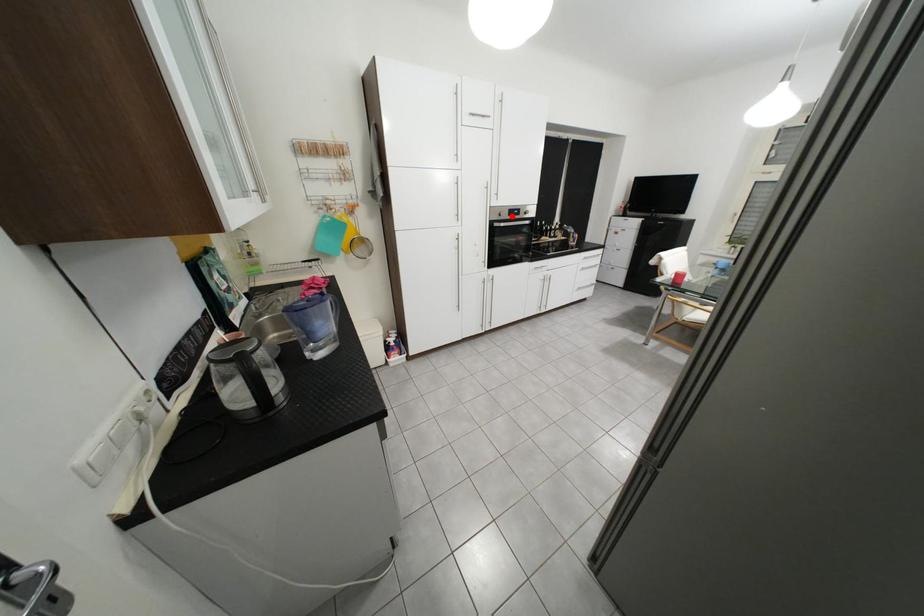
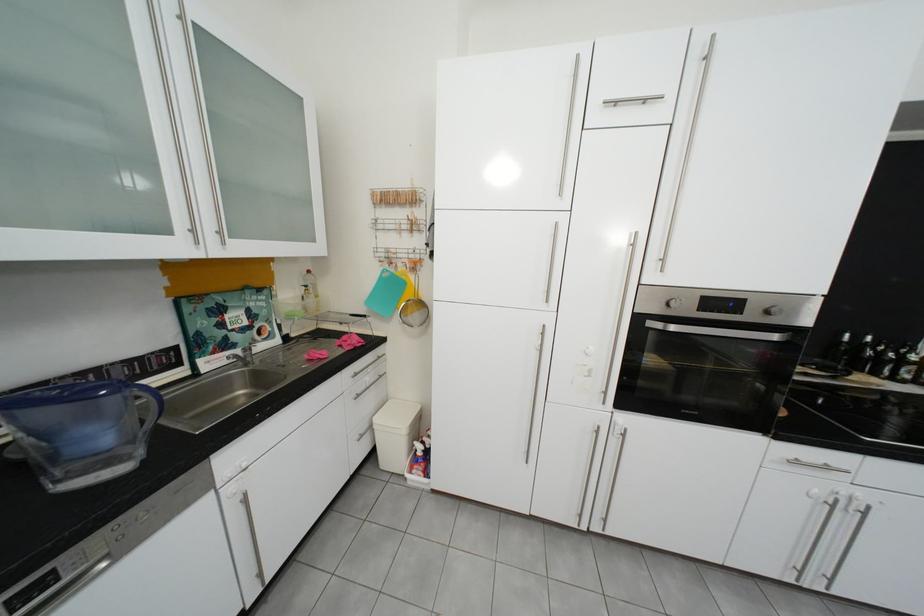
Question: I am providing you with two images of the same scene from different viewpoints. In image1, a red point is highlighted. Considering the same 3D point in image2, which of the following is correct?

Choices:
 (A) It is closer
 (B) It is farther

Answer: (B)